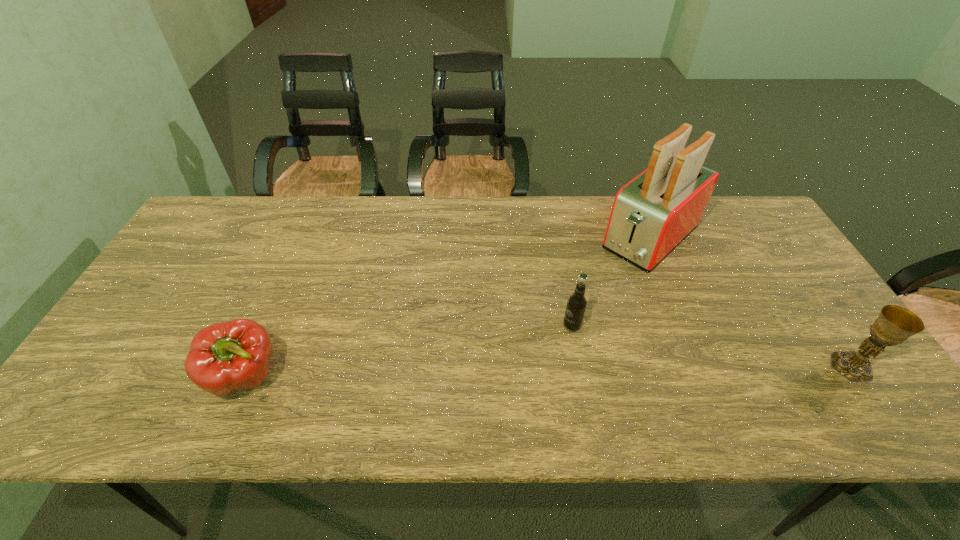
This screenshot has width=960, height=540. I want to click on vacant area situated 0.190m on the front-facing side of the tallest object, so click(x=584, y=298).

You are a GUI agent. You are given a task and a screenshot of the screen. Output one action in this format:
    pyautogui.click(x=<x>, y=<y>)
    Task: Click on the vacant space located 0.170m on the label of the third nearest object
    The height and width of the screenshot is (540, 960).
    Given the screenshot: What is the action you would take?
    pyautogui.click(x=520, y=371)

You are a GUI agent. You are given a task and a screenshot of the screen. Output one action in this format:
    pyautogui.click(x=<x>, y=<y>)
    Task: Click on the vacant area situated on the label of the third nearest object
    
    Given the screenshot: What is the action you would take?
    pyautogui.click(x=502, y=387)

Where is `vacant region located 0.250m on the label of the third nearest object`? vacant region located 0.250m on the label of the third nearest object is located at coordinates (495, 392).

The image size is (960, 540). Identify the location of object that is at the far edge. (651, 215).

This screenshot has width=960, height=540. I want to click on pepper located in the near edge section of the desktop, so click(225, 357).

What are the coordinates of `chalice situated at the near edge` in the screenshot? It's located at (894, 324).

Where is `object that is at the right edge`? The image size is (960, 540). object that is at the right edge is located at coordinates (894, 324).

Image resolution: width=960 pixels, height=540 pixels. I want to click on object situated at the near right corner, so click(x=894, y=324).

You are a GUI agent. You are given a task and a screenshot of the screen. Output one action in this format:
    pyautogui.click(x=<x>, y=<y>)
    Task: Click on the vacant space at the far edge of the desktop
    The width and height of the screenshot is (960, 540).
    Given the screenshot: What is the action you would take?
    pyautogui.click(x=453, y=206)